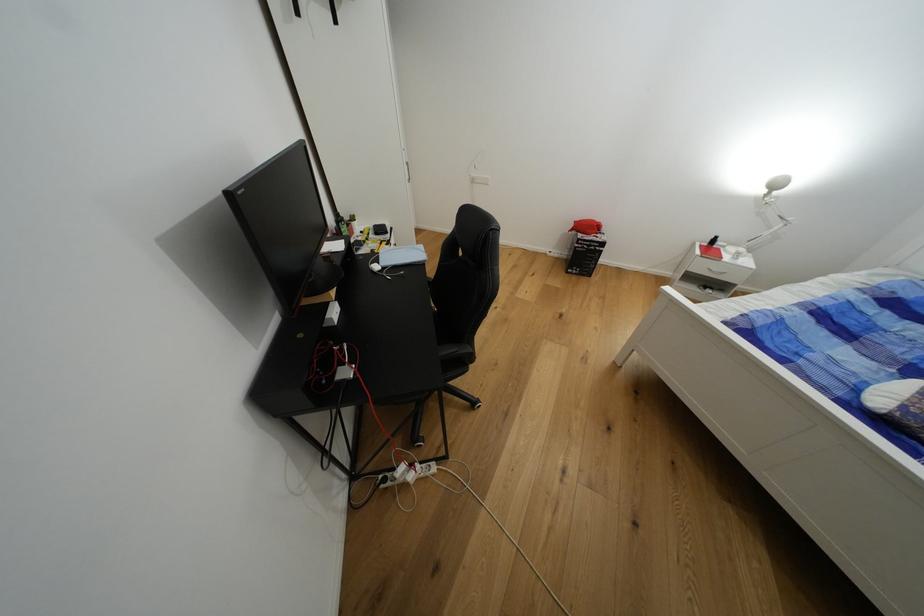
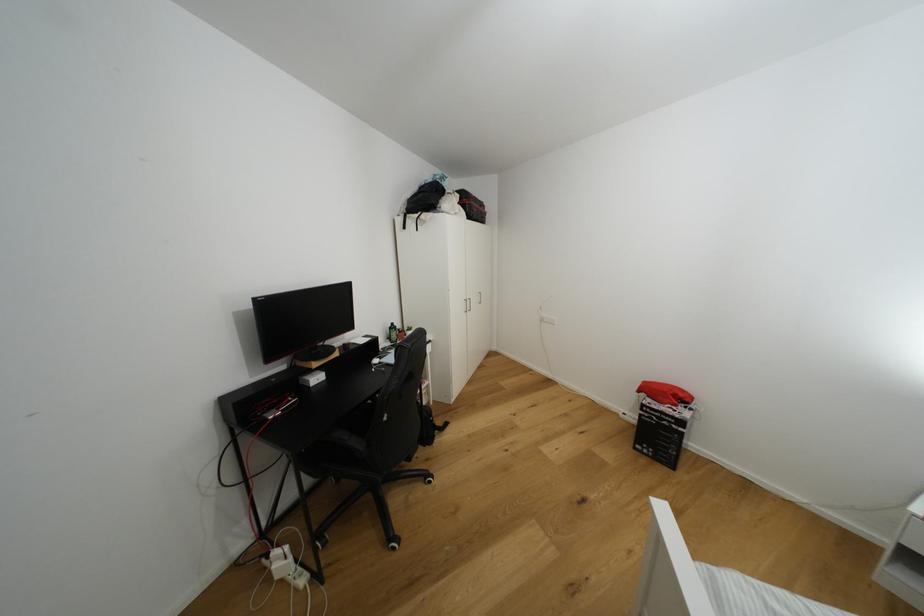
First-person continuous shooting, in which direction is the camera rotating?

The camera's rotation is toward left-up.